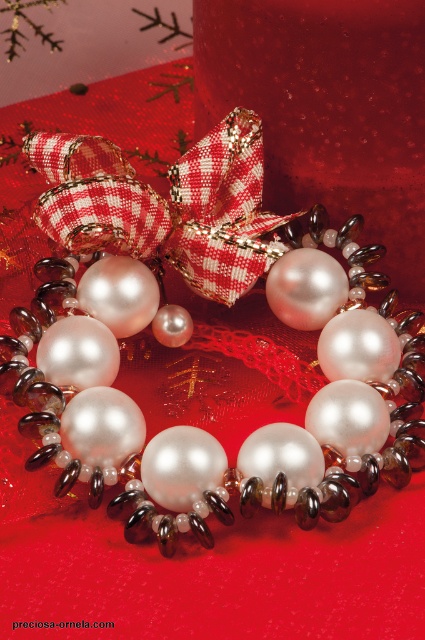
Is pearl/resin necklace at center taller than red checkered ribbon at center?

Correct, pearl/resin necklace at center is much taller as red checkered ribbon at center.

Is point (314, 269) closer to viewer compared to point (192, 273)?

Yes.

Which is behind, point (337, 369) or point (87, 156)?

Positioned behind is point (87, 156).

Find the location of a particular element. pearl/resin necklace at center is located at coordinates (189, 337).